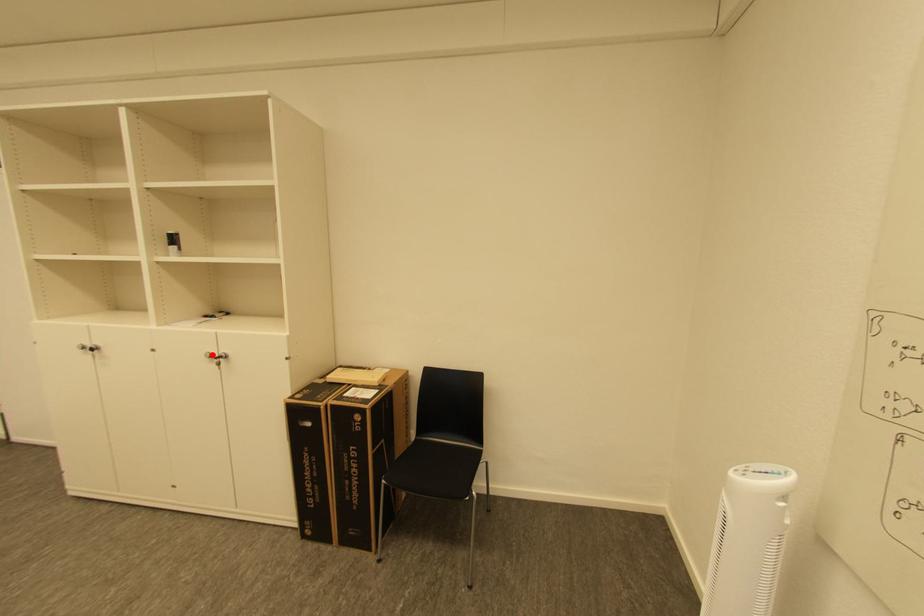
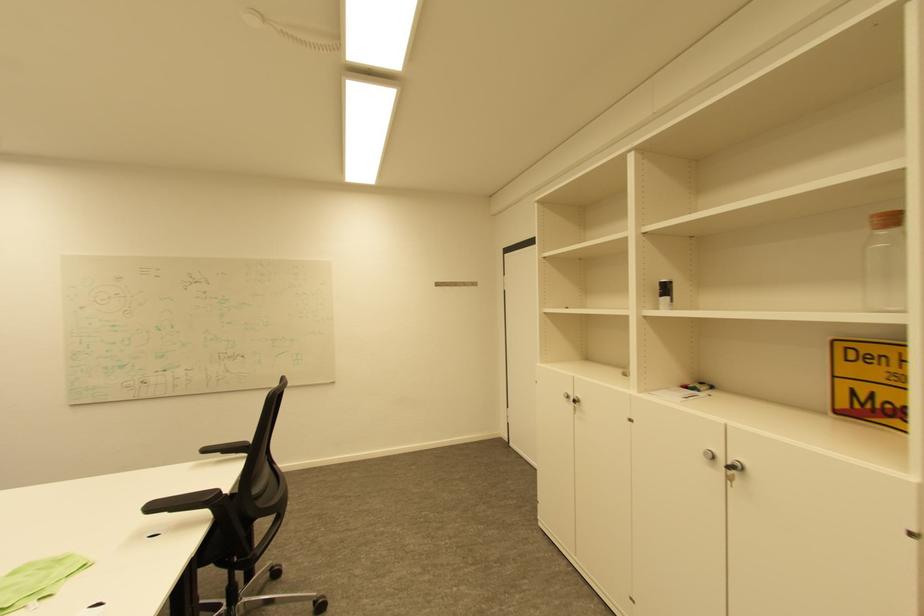
Locate, in the second image, the point that corresponds to the highlighted location in the first image.

(711, 453)